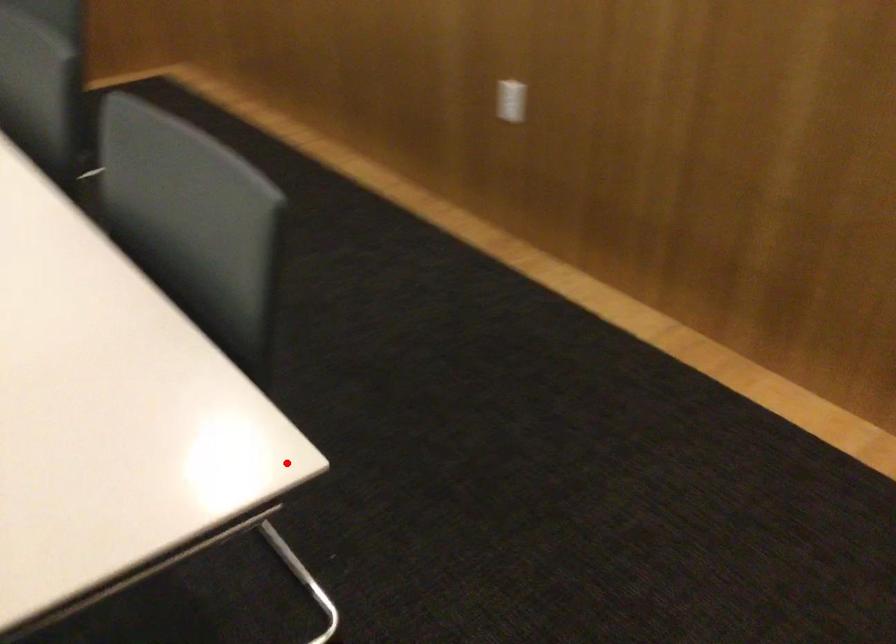
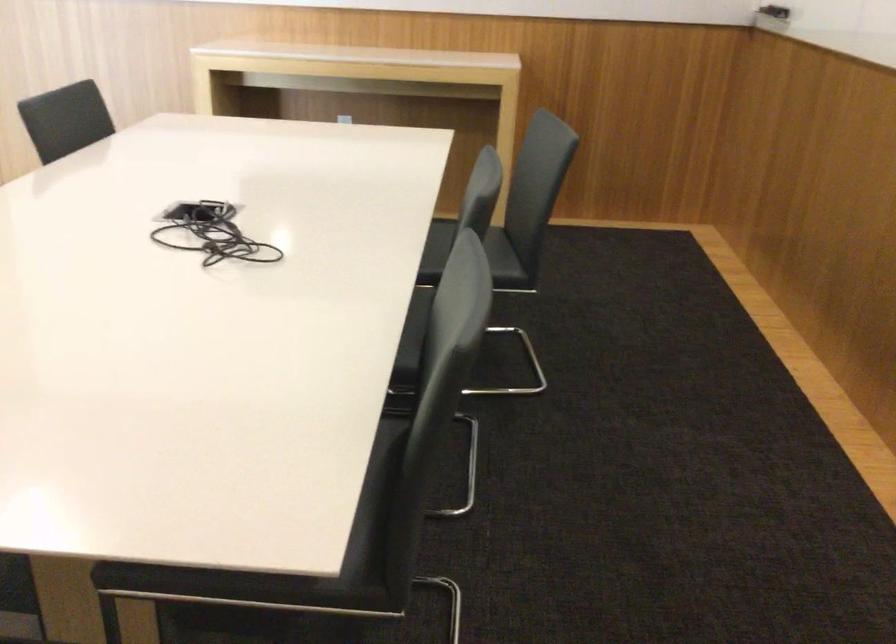
Question: I am providing you with two images of the same scene from different viewpoints. Image1 has a red point marked. In image2, the corresponding 3D location appears at what relative position? Reply with the corresponding letter.

Choices:
 (A) Closer
 (B) Farther

Answer: (B)